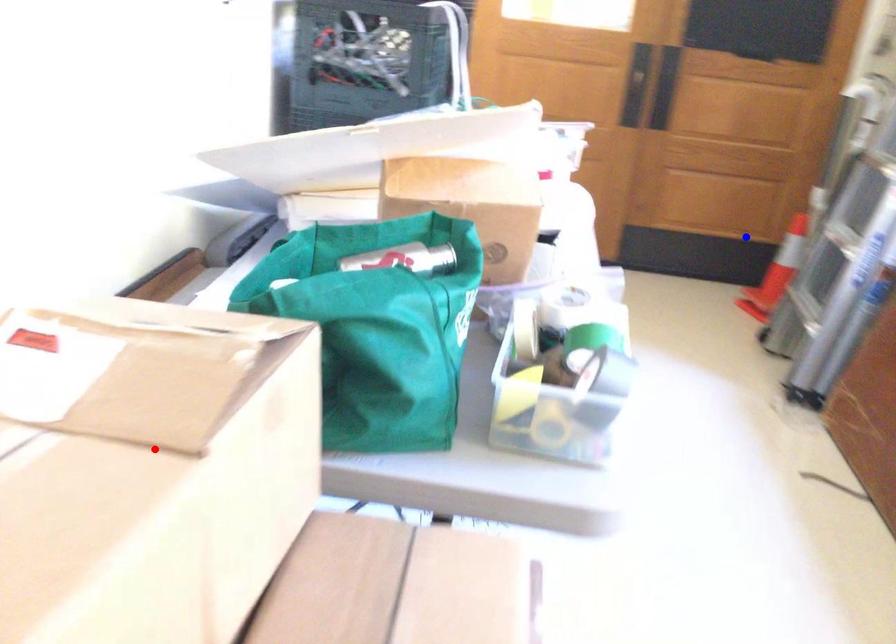
Question: Which of the two points in the image is closer to the camera?

Choices:
 (A) Blue point is closer.
 (B) Red point is closer.

Answer: (B)